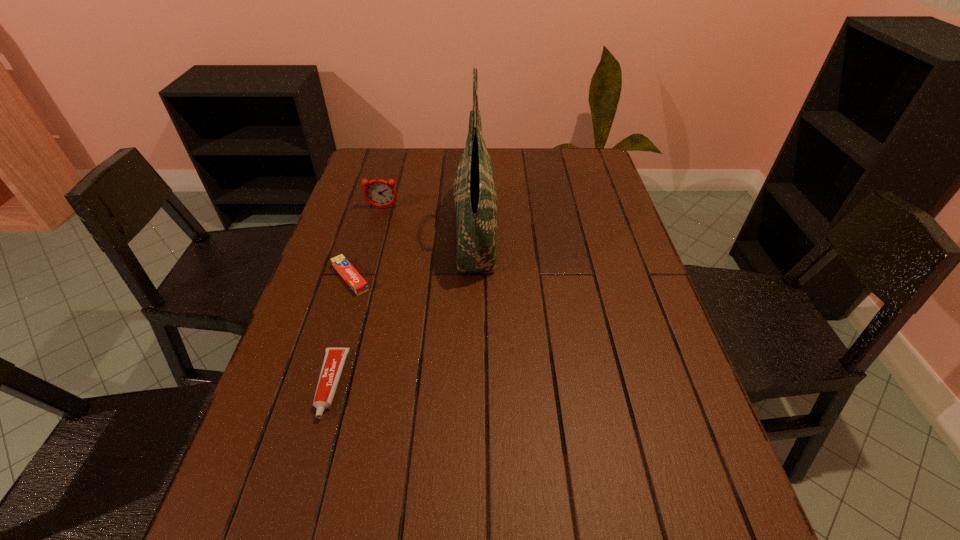
At what (x,y) coordinates should I click in order to perform the action: click on tote bag. Please return your answer as a coordinate pair (x, y). The image size is (960, 540). Looking at the image, I should click on (475, 197).

The image size is (960, 540). Find the location of `the tallest object`. the tallest object is located at coordinates (475, 197).

I want to click on the second tallest object, so click(379, 193).

Where is `the nearer toothpaste`? This screenshot has height=540, width=960. the nearer toothpaste is located at coordinates (334, 359).

The image size is (960, 540). Find the location of `the nearest object`. the nearest object is located at coordinates (334, 359).

What are the coordinates of `the shortest object` in the screenshot? It's located at (357, 283).

In order to click on the shorter toothpaste in this screenshot , I will do point(357,283).

I want to click on free location located 0.270m on the right of the tallest object, so click(588, 233).

Where is `vacant area situated 0.240m on the front-facing side of the alarm clock`? The height and width of the screenshot is (540, 960). vacant area situated 0.240m on the front-facing side of the alarm clock is located at coordinates (368, 261).

The width and height of the screenshot is (960, 540). Find the location of `vacant space located 0.050m at the nozzle of the taller toothpaste`. vacant space located 0.050m at the nozzle of the taller toothpaste is located at coordinates (313, 446).